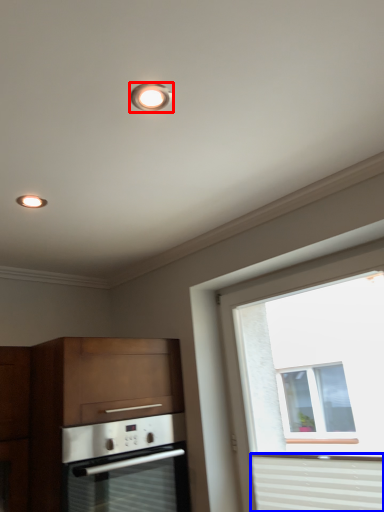
Question: Which object appears closest to the camera in this image, lighting (highlighted by a red box) or curtain (highlighted by a blue box)?

Choices:
 (A) lighting
 (B) curtain

Answer: (A)